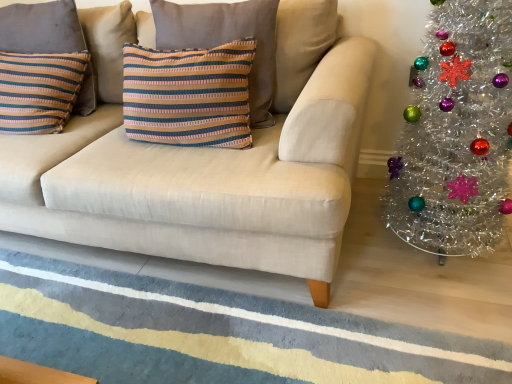
Locate an element on the screen. Image resolution: width=512 pixels, height=384 pixels. free space in front of tinsel silver christmas tree at right is located at coordinates (x=439, y=315).